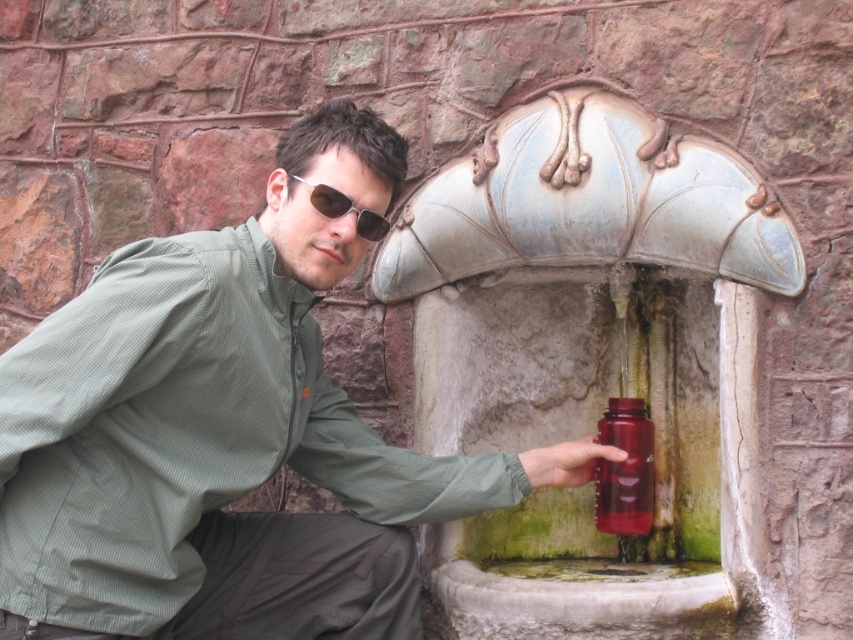
You are a photographer trying to capture a closeup of the olive green fabric shirt at center and the sunglasses at center. Since you want both items to be clearly visible in the photo, which one should you focus on to ensure clarity?

The olive green fabric shirt at center is larger in size than sunglasses at center, so you should focus on the olive green fabric shirt at center to ensure both items are clearly visible.

You are a photographer trying to capture the person filling the translucent red bottle at lower center. Since the olive green fabric shirt at center is blocking part of the view, can you adjust your position to see the entire bottle without moving the person?

The olive green fabric shirt at center is larger in size than translucent red bottle at lower center, so adjusting your position slightly might allow you to see the entire bottle by moving around the obstruction caused by the shirt.

You are a photographer trying to capture a clear shot of the sunglasses at center and the olive green fabric shirt at center. Since you want both items in focus, you need to know their positions relative to each other. Which object is positioned to the left?

The olive green fabric shirt at center is to the left of sunglasses at center.